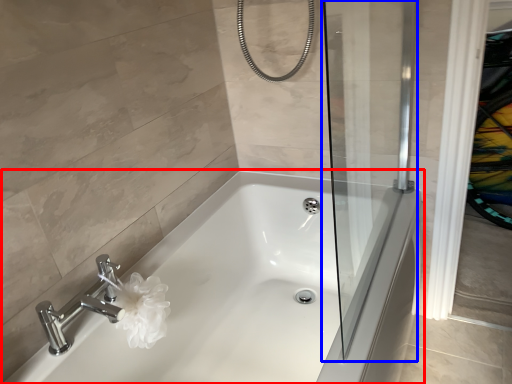
Question: Which of the following is the farthest to the observer, bathtub (highlighted by a red box) or screen door (highlighted by a blue box)?

Choices:
 (A) bathtub
 (B) screen door

Answer: (A)